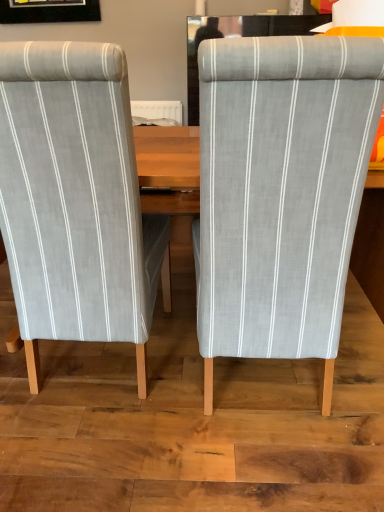
This screenshot has height=512, width=384. What do you see at coordinates (76, 200) in the screenshot?
I see `light gray striped fabric chair at left, which is the 2th chair in right-to-left order` at bounding box center [76, 200].

Find the location of `light gray striped fabric chair at left, which is the 2th chair in right-to-left order`. light gray striped fabric chair at left, which is the 2th chair in right-to-left order is located at coordinates (76, 200).

Describe the element at coordinates (281, 193) in the screenshot. I see `gray fabric chair at center, positioned as the second chair in left-to-right order` at that location.

The image size is (384, 512). Find the location of `gray fabric chair at center, positioned as the second chair in left-to-right order`. gray fabric chair at center, positioned as the second chair in left-to-right order is located at coordinates (281, 193).

The image size is (384, 512). Identify the location of light gray striped fabric chair at left, arranged as the first chair when viewed from the left. (76, 200).

In the scene shown: Considering the relative positions of light gray striped fabric chair at left, arranged as the first chair when viewed from the left, and gray fabric chair at center, positioned as the second chair in left-to-right order, in the image provided, is light gray striped fabric chair at left, arranged as the first chair when viewed from the left, to the right of gray fabric chair at center, positioned as the second chair in left-to-right order, from the viewer's perspective?

No, light gray striped fabric chair at left, arranged as the first chair when viewed from the left, is not to the right of gray fabric chair at center, positioned as the second chair in left-to-right order.

Consider the image. Which object is further away from the camera, light gray striped fabric chair at left, which is the 2th chair in right-to-left order, or gray fabric chair at center, which appears as the 1th chair when viewed from the right?

light gray striped fabric chair at left, which is the 2th chair in right-to-left order.

Which is farther, (106, 284) or (337, 142)?

The point (106, 284) is behind.

From the image's perspective, is light gray striped fabric chair at left, arranged as the first chair when viewed from the left, located above gray fabric chair at center, which appears as the 1th chair when viewed from the right?

Correct, light gray striped fabric chair at left, arranged as the first chair when viewed from the left, appears higher than gray fabric chair at center, which appears as the 1th chair when viewed from the right, in the image.

From a real-world perspective, does light gray striped fabric chair at left, which is the 2th chair in right-to-left order, sit lower than gray fabric chair at center, which appears as the 1th chair when viewed from the right?

Correct, in the physical world, light gray striped fabric chair at left, which is the 2th chair in right-to-left order, is lower than gray fabric chair at center, which appears as the 1th chair when viewed from the right.

Can you confirm if light gray striped fabric chair at left, which is the 2th chair in right-to-left order, is thinner than gray fabric chair at center, which appears as the 1th chair when viewed from the right?

Correct, the width of light gray striped fabric chair at left, which is the 2th chair in right-to-left order, is less than that of gray fabric chair at center, which appears as the 1th chair when viewed from the right.

From their relative heights in the image, would you say light gray striped fabric chair at left, arranged as the first chair when viewed from the left, is taller or shorter than gray fabric chair at center, which appears as the 1th chair when viewed from the right?

In the image, light gray striped fabric chair at left, arranged as the first chair when viewed from the left, appears to be shorter than gray fabric chair at center, which appears as the 1th chair when viewed from the right.

Which of these two, light gray striped fabric chair at left, which is the 2th chair in right-to-left order, or gray fabric chair at center, which appears as the 1th chair when viewed from the right, is bigger?

light gray striped fabric chair at left, which is the 2th chair in right-to-left order.

Is gray fabric chair at center, positioned as the second chair in left-to-right order, inside light gray striped fabric chair at left, which is the 2th chair in right-to-left order?

No, gray fabric chair at center, positioned as the second chair in left-to-right order, is not a part of light gray striped fabric chair at left, which is the 2th chair in right-to-left order.

In the scene shown: Are light gray striped fabric chair at left, which is the 2th chair in right-to-left order, and gray fabric chair at center, positioned as the second chair in left-to-right order, far apart?

No, light gray striped fabric chair at left, which is the 2th chair in right-to-left order, is in close proximity to gray fabric chair at center, positioned as the second chair in left-to-right order.

Is light gray striped fabric chair at left, which is the 2th chair in right-to-left order, positioned with its back to gray fabric chair at center, positioned as the second chair in left-to-right order?

No, light gray striped fabric chair at left, which is the 2th chair in right-to-left order,'s orientation is not away from gray fabric chair at center, positioned as the second chair in left-to-right order.

How many degrees apart are the facing directions of light gray striped fabric chair at left, which is the 2th chair in right-to-left order, and gray fabric chair at center, positioned as the second chair in left-to-right order?

They differ by 1.11e-05 degrees in their facing directions.

How far apart are light gray striped fabric chair at left, which is the 2th chair in right-to-left order, and gray fabric chair at center, positioned as the second chair in left-to-right order?

light gray striped fabric chair at left, which is the 2th chair in right-to-left order, is 14.50 inches from gray fabric chair at center, positioned as the second chair in left-to-right order.

Find the location of a particular element. The height and width of the screenshot is (512, 384). chair on the right side of light gray striped fabric chair at left, which is the 2th chair in right-to-left order is located at coordinates (281, 193).

Would you say gray fabric chair at center, positioned as the second chair in left-to-right order, is to the left or to the right of light gray striped fabric chair at left, arranged as the first chair when viewed from the left, in the picture?

gray fabric chair at center, positioned as the second chair in left-to-right order, is to the right of light gray striped fabric chair at left, arranged as the first chair when viewed from the left.

Is the position of gray fabric chair at center, which appears as the 1th chair when viewed from the right, more distant than that of light gray striped fabric chair at left, arranged as the first chair when viewed from the left?

No, it is in front of light gray striped fabric chair at left, arranged as the first chair when viewed from the left.

Which point is more distant from viewer, (345,141) or (32,329)?

The point (32,329) is farther.

From the image's perspective, between gray fabric chair at center, positioned as the second chair in left-to-right order, and light gray striped fabric chair at left, arranged as the first chair when viewed from the left, who is located below?

From the image's view, gray fabric chair at center, positioned as the second chair in left-to-right order, is below.

From a real-world perspective, is gray fabric chair at center, which appears as the 1th chair when viewed from the right, beneath light gray striped fabric chair at left, arranged as the first chair when viewed from the left?

No, from a real-world perspective, gray fabric chair at center, which appears as the 1th chair when viewed from the right, is not below light gray striped fabric chair at left, arranged as the first chair when viewed from the left.

Considering the sizes of objects gray fabric chair at center, which appears as the 1th chair when viewed from the right, and light gray striped fabric chair at left, which is the 2th chair in right-to-left order, in the image provided, who is thinner, gray fabric chair at center, which appears as the 1th chair when viewed from the right, or light gray striped fabric chair at left, which is the 2th chair in right-to-left order,?

light gray striped fabric chair at left, which is the 2th chair in right-to-left order.

Who is taller, gray fabric chair at center, which appears as the 1th chair when viewed from the right, or light gray striped fabric chair at left, which is the 2th chair in right-to-left order?

With more height is gray fabric chair at center, which appears as the 1th chair when viewed from the right.

Can you confirm if gray fabric chair at center, which appears as the 1th chair when viewed from the right, is smaller than light gray striped fabric chair at left, arranged as the first chair when viewed from the left?

Yes, gray fabric chair at center, which appears as the 1th chair when viewed from the right, is smaller than light gray striped fabric chair at left, arranged as the first chair when viewed from the left.

Is gray fabric chair at center, positioned as the second chair in left-to-right order, situated inside light gray striped fabric chair at left, which is the 2th chair in right-to-left order, or outside?

gray fabric chair at center, positioned as the second chair in left-to-right order, is spatially situated outside light gray striped fabric chair at left, which is the 2th chair in right-to-left order.

Are gray fabric chair at center, which appears as the 1th chair when viewed from the right, and light gray striped fabric chair at left, arranged as the first chair when viewed from the left, located far from each other?

No.

Is light gray striped fabric chair at left, arranged as the first chair when viewed from the left, at the back of gray fabric chair at center, which appears as the 1th chair when viewed from the right?

gray fabric chair at center, which appears as the 1th chair when viewed from the right, is not turned away from light gray striped fabric chair at left, arranged as the first chair when viewed from the left.

How distant is gray fabric chair at center, which appears as the 1th chair when viewed from the right, from light gray striped fabric chair at left, arranged as the first chair when viewed from the left?

The distance of gray fabric chair at center, which appears as the 1th chair when viewed from the right, from light gray striped fabric chair at left, arranged as the first chair when viewed from the left, is 14.50 inches.

I want to click on chair located on the left of gray fabric chair at center, which appears as the 1th chair when viewed from the right, so click(x=76, y=200).

Locate an element on the screen. chair on the right side of light gray striped fabric chair at left, arranged as the first chair when viewed from the left is located at coordinates (281, 193).

You are a GUI agent. You are given a task and a screenshot of the screen. Output one action in this format:
    pyautogui.click(x=<x>, y=<y>)
    Task: Click on the chair below the gray fabric chair at center, positioned as the second chair in left-to-right order (from a real-world perspective)
    Image resolution: width=384 pixels, height=512 pixels.
    Given the screenshot: What is the action you would take?
    pyautogui.click(x=76, y=200)